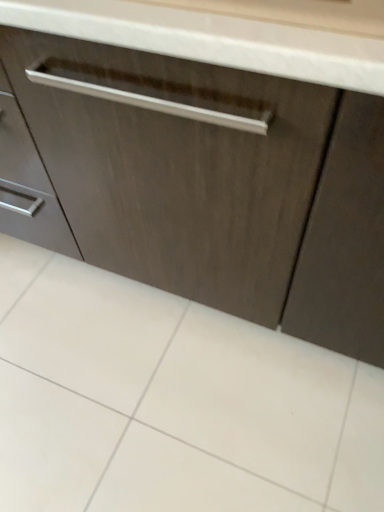
Find the location of a particular element. This screenshot has width=384, height=512. matte wood cabinet at center is located at coordinates (218, 185).

Image resolution: width=384 pixels, height=512 pixels. Describe the element at coordinates (218, 185) in the screenshot. I see `matte wood cabinet at center` at that location.

Measure the distance between point (354,203) and camera.

Point (354,203) is 27.05 inches from camera.

Measure the distance between matte wood cabinet at center and camera.

A distance of 21.55 inches exists between matte wood cabinet at center and camera.

Where is `matte wood cabinet at center`? matte wood cabinet at center is located at coordinates (218, 185).